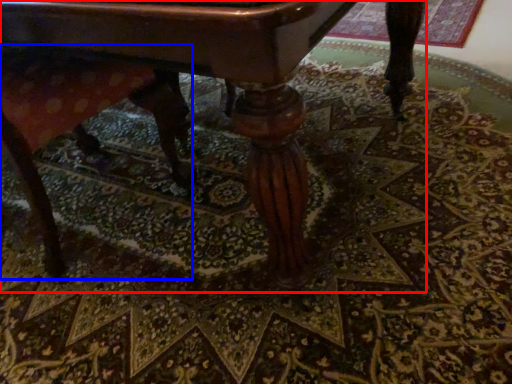
Question: Among these objects, which one is farthest to the camera, table (highlighted by a red box) or swivel chair (highlighted by a blue box)?

Choices:
 (A) table
 (B) swivel chair

Answer: (B)